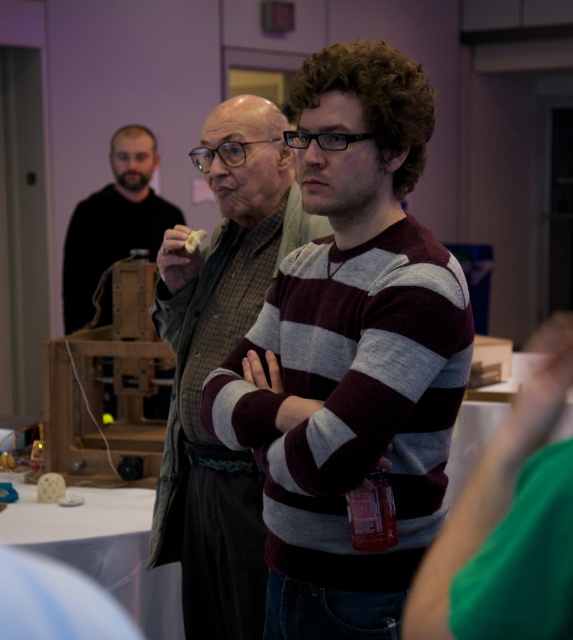
Can you confirm if striped cotton sweater at center is positioned above striped sweater at center?

Indeed, striped cotton sweater at center is positioned over striped sweater at center.

How much distance is there between striped cotton sweater at center and striped sweater at center?

48.94 centimeters

Is point (394, 196) farther from camera compared to point (162, 244)?

No, it is not.

Where is `striped cotton sweater at center`? The width and height of the screenshot is (573, 640). striped cotton sweater at center is located at coordinates (351, 353).

Does matte black shirt at left have a lesser width compared to yellow crumbly food at center?

In fact, matte black shirt at left might be wider than yellow crumbly food at center.

Can you confirm if matte black shirt at left is shorter than yellow crumbly food at center?

No, matte black shirt at left is not shorter than yellow crumbly food at center.

You are a GUI agent. You are given a task and a screenshot of the screen. Output one action in this format:
    pyautogui.click(x=<x>, y=<y>)
    Task: Click on the matte black shirt at left
    
    Given the screenshot: What is the action you would take?
    pyautogui.click(x=113, y=221)

What are the coordinates of `matte black shirt at left` in the screenshot? It's located at (113, 221).

How far apart are striped cotton sweater at center and yellow crumbly food at center?

The distance of striped cotton sweater at center from yellow crumbly food at center is 30.68 inches.

Who is more forward, [308,198] or [190,241]?

Positioned in front is point [308,198].

Between point (273, 611) and point (198, 230), which one is positioned behind?

The point (198, 230) is more distant.

You are a GUI agent. You are given a task and a screenshot of the screen. Output one action in this format:
    pyautogui.click(x=<x>, y=<y>)
    Task: Click on the striped cotton sweater at center
    This screenshot has width=573, height=640.
    Given the screenshot: What is the action you would take?
    pyautogui.click(x=351, y=353)